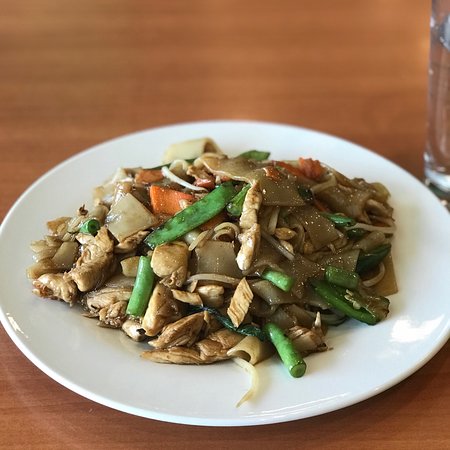
Where is `plate`? The height and width of the screenshot is (450, 450). plate is located at coordinates (352, 353).